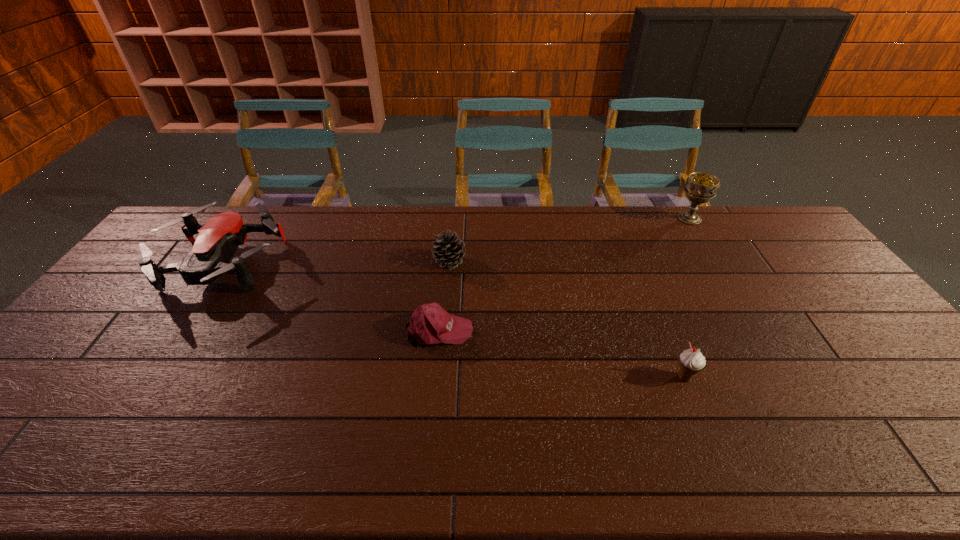
I want to click on free space located 0.100m on the right of the pinecone, so click(496, 261).

Locate an element on the screen. free region located on the front of the nearest object is located at coordinates (699, 414).

Image resolution: width=960 pixels, height=540 pixels. Find the location of `vacant space located 0.240m at the front of the fourth farthest object with the brim`. vacant space located 0.240m at the front of the fourth farthest object with the brim is located at coordinates (559, 330).

Identify the location of chalice that is positioned at the far edge. The image size is (960, 540). (700, 187).

You are a GUI agent. You are given a task and a screenshot of the screen. Output one action in this format:
    pyautogui.click(x=<x>, y=<y>)
    Task: Click on the drone that is at the far edge
    This screenshot has height=540, width=960.
    Given the screenshot: What is the action you would take?
    pyautogui.click(x=219, y=238)

Identify the location of object positioned at the left edge. The width and height of the screenshot is (960, 540). (219, 238).

Locate an element on the screen. object that is at the far left corner is located at coordinates (219, 238).

Locate an element on the screen. vacant region at the far edge of the desktop is located at coordinates (356, 244).

Identify the location of vacant space at the near edge of the desktop. [x=287, y=453].

Image resolution: width=960 pixels, height=540 pixels. Find the location of `vacant region at the left edge of the desktop`. vacant region at the left edge of the desktop is located at coordinates (123, 309).